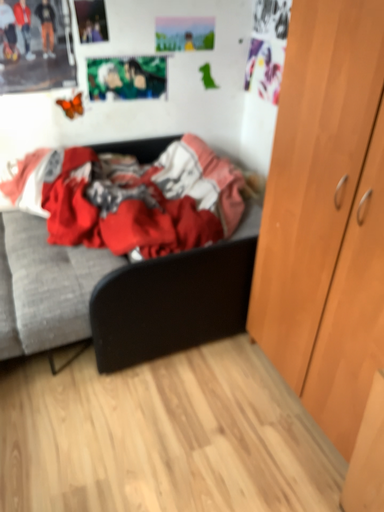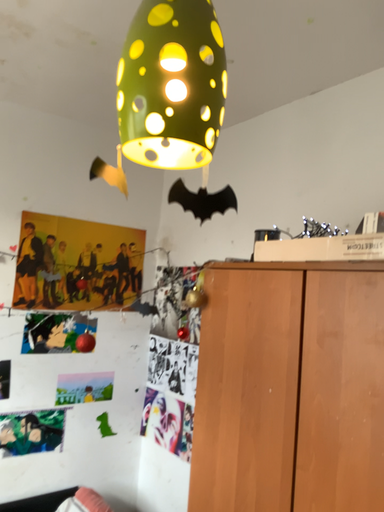
Question: Which way did the camera rotate in the video?

Choices:
 (A) rotated downward
 (B) rotated upward

Answer: (B)